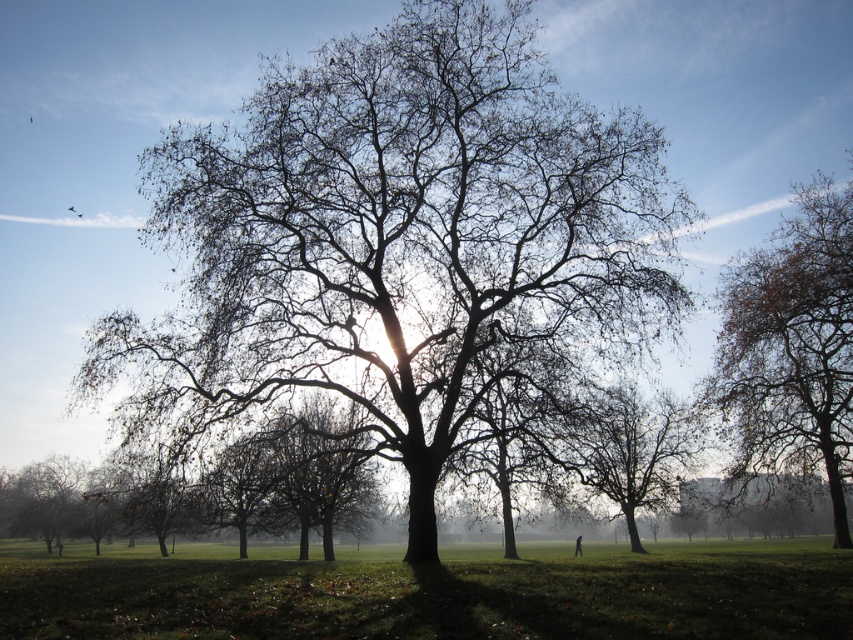
Can you confirm if brown textured tree at right is positioned above smooth gray tree at lower left?

Yes, brown textured tree at right is above smooth gray tree at lower left.

The width and height of the screenshot is (853, 640). What do you see at coordinates (792, 346) in the screenshot?
I see `brown textured tree at right` at bounding box center [792, 346].

Identify the location of brown textured tree at right. (792, 346).

Which is more to the left, brown textured tree at right or brown/dry wood tree at center?

brown/dry wood tree at center

Can you confirm if brown textured tree at right is positioned below brown/dry wood tree at center?

Incorrect, brown textured tree at right is not positioned below brown/dry wood tree at center.

Who is more forward, (849,188) or (337,413)?

Point (849,188)

I want to click on brown textured tree at right, so click(x=792, y=346).

Is brown textured tree at right to the left of smooth bark tree at center from the viewer's perspective?

In fact, brown textured tree at right is to the right of smooth bark tree at center.

Does brown textured tree at right have a greater height compared to smooth bark tree at center?

Yes, brown textured tree at right is taller than smooth bark tree at center.

Measure the distance between point [721,312] and camera.

Point [721,312] is 40.84 meters away from camera.

You are a GUI agent. You are given a task and a screenshot of the screen. Output one action in this format:
    pyautogui.click(x=<x>, y=<y>)
    Task: Click on the brown textured tree at right
    This screenshot has width=853, height=640.
    Given the screenshot: What is the action you would take?
    pyautogui.click(x=792, y=346)